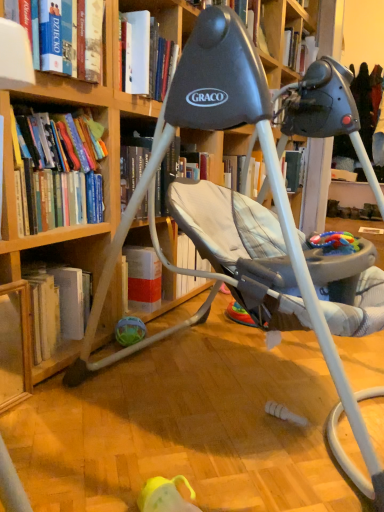
Question: Looking at the image, does hardcover books at left, arranged as the second book when viewed from the top, seem bigger or smaller compared to translucent plastic ball at lower center, which ranks as the second toy in right-to-left order?

Choices:
 (A) big
 (B) small

Answer: (A)

Question: In terms of width, does hardcover books at left, the 1th book in the bottom-to-top sequence, look wider or thinner when compared to translucent plastic ball at lower center, acting as the 2th toy starting from the top?

Choices:
 (A) wide
 (B) thin

Answer: (A)

Question: Which object is positioned farthest from the wooden bookcase at center?

Choices:
 (A) multicolored plastic toy at center, the 2th toy from the bottom
 (B) wooden bookshelf at lower left, which ranks as the 2th shelf in front-to-back order
 (C) hardcover books at left, the 1th book in the bottom-to-top sequence
 (D) wooden bookshelf at lower left, the first shelf from the front
 (E) hardcover book at upper left, which is the 1th book in top-to-bottom order

Answer: (A)

Question: Estimate the real-world distances between objects in this image. Which object is farther from the wooden bookshelf at lower left, which appears as the 2th shelf when viewed from the back?

Choices:
 (A) wooden bookshelf at lower left, which ranks as the 2th shelf in front-to-back order
 (B) wooden bookcase at center
 (C) translucent plastic ball at lower center, the 1th toy positioned from the left
 (D) hardcover books at left, the 1th book in the bottom-to-top sequence
 (E) multicolored plastic toy at center, the 1th toy positioned from the front

Answer: (E)